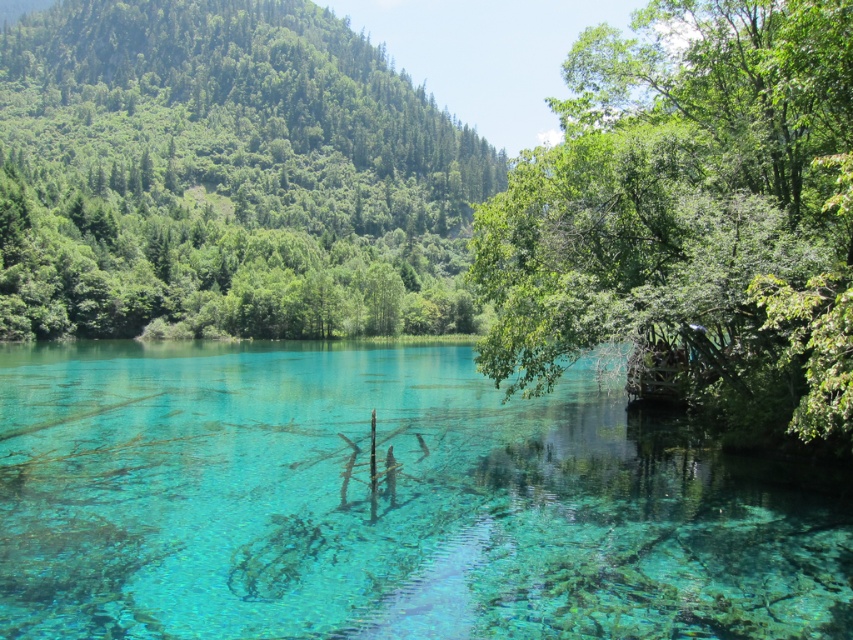
Question: Which object is the farthest from the transparent water at center?

Choices:
 (A) green leafy tree at upper left
 (B) green leafy tree at right

Answer: (A)

Question: Can you confirm if transparent water at center is wider than green leafy tree at right?

Choices:
 (A) yes
 (B) no

Answer: (A)

Question: Is transparent water at center closer to the viewer compared to green leafy tree at right?

Choices:
 (A) yes
 (B) no

Answer: (B)

Question: Does green leafy tree at upper left have a lesser width compared to green leafy tree at right?

Choices:
 (A) no
 (B) yes

Answer: (A)

Question: Which object appears closest to the camera in this image?

Choices:
 (A) green leafy tree at upper left
 (B) transparent water at center
 (C) green leafy tree at right

Answer: (C)

Question: Considering the real-world distances, which object is closest to the green leafy tree at upper left?

Choices:
 (A) transparent water at center
 (B) green leafy tree at right

Answer: (A)